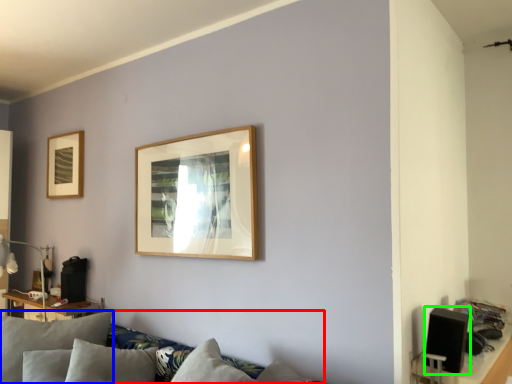
Question: Which is farther away from couch (highlighted by a red box)? pillow (highlighted by a blue box) or speaker (highlighted by a green box)?

Choices:
 (A) pillow
 (B) speaker

Answer: (B)